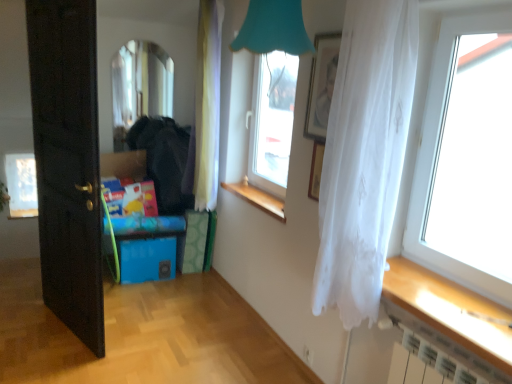
Where is `black wood door at left`? black wood door at left is located at coordinates (68, 162).

Describe the element at coordinates (164, 159) in the screenshot. The height and width of the screenshot is (384, 512). I see `matte black jacket at center` at that location.

Find the location of a particular element. This screenshot has height=384, width=512. transparent glass window at center, arranged as the second window when viewed from the front is located at coordinates (272, 121).

Identify the location of clear glass mirror at upper left, marked as the second window in a back-to-front arrangement. This screenshot has height=384, width=512. (140, 86).

What do you see at coordinates (140, 86) in the screenshot?
I see `clear glass mirror at upper left, which ranks as the 2th window in left-to-right order` at bounding box center [140, 86].

Locate an element on the screen. The height and width of the screenshot is (384, 512). black wood door at left is located at coordinates (68, 162).

Is white paper at left, the 1th window viewed from the left, turned away from blue plastic storage box at lower left?

white paper at left, the 1th window viewed from the left, does not have its back to blue plastic storage box at lower left.

Can you tell me how much white paper at left, arranged as the 4th window when viewed from the front, and blue plastic storage box at lower left differ in facing direction?

5.68 degrees.

From a real-world perspective, is white paper at left, the 1th window viewed from the left, physically located above or below blue plastic storage box at lower left?

Clearly, from a real-world perspective, white paper at left, the 1th window viewed from the left, is below blue plastic storage box at lower left.

Does white paper at left, the 1th window viewed from the left, come in front of blue plastic storage box at lower left?

No, the depth of white paper at left, the 1th window viewed from the left, is greater than that of blue plastic storage box at lower left.

Is matte black jacket at center situated inside transparent glass window at right, the 4th window positioned from the left, or outside?

matte black jacket at center cannot be found inside transparent glass window at right, the 4th window positioned from the left.

Considering the sizes of matte black jacket at center and transparent glass window at right, which appears as the fourth window when viewed from the back, in the image, is matte black jacket at center taller or shorter than transparent glass window at right, which appears as the fourth window when viewed from the back,?

matte black jacket at center is shorter than transparent glass window at right, which appears as the fourth window when viewed from the back.

Does matte black jacket at center appear on the right side of transparent glass window at right, acting as the 1th window starting from the front?

Incorrect, matte black jacket at center is not on the right side of transparent glass window at right, acting as the 1th window starting from the front.

Does transparent glass window at center, the third window viewed from the back, have a lesser height compared to transparent fabric curtain at right?

No, transparent glass window at center, the third window viewed from the back, is not shorter than transparent fabric curtain at right.

Choose the correct answer: Is transparent glass window at center, acting as the second window starting from the right, inside transparent fabric curtain at right or outside it?

transparent glass window at center, acting as the second window starting from the right, is outside transparent fabric curtain at right.

Does transparent glass window at center, the third window viewed from the back, come in front of transparent fabric curtain at right?

No, the depth of transparent glass window at center, the third window viewed from the back, is greater than that of transparent fabric curtain at right.

From the image's perspective, who appears lower, matte silver picture frame at upper center or black wood door at left?

black wood door at left is shown below in the image.

Considering the sizes of matte silver picture frame at upper center and black wood door at left in the image, is matte silver picture frame at upper center taller or shorter than black wood door at left?

Clearly, matte silver picture frame at upper center is shorter compared to black wood door at left.

Who is bigger, matte silver picture frame at upper center or black wood door at left?

black wood door at left.

Where is `the 2nd window counting from the right side of the white paper at left, the 1th window viewed from the left`? the 2nd window counting from the right side of the white paper at left, the 1th window viewed from the left is located at coordinates (272, 121).

From a real-world perspective, is transparent glass window at center, acting as the second window starting from the right, positioned above or below white paper at left, arranged as the 4th window when viewed from the front?

In terms of real-world spatial position, transparent glass window at center, acting as the second window starting from the right, is above white paper at left, arranged as the 4th window when viewed from the front.

Would you consider transparent glass window at center, acting as the second window starting from the right, to be distant from white paper at left, arranged as the 4th window when viewed from the front?

Indeed, transparent glass window at center, acting as the second window starting from the right, is not near white paper at left, arranged as the 4th window when viewed from the front.

Which is more to the right, transparent glass window at center, which ranks as the 3th window in left-to-right order, or white paper at left, the 1th window viewed from the left?

Result: From the viewer's perspective, transparent glass window at center, which ranks as the 3th window in left-to-right order, appears more on the right side.

Where is `curtain below the transparent glass window at center, which ranks as the 3th window in left-to-right order (from a real-world perspective)`? The width and height of the screenshot is (512, 384). curtain below the transparent glass window at center, which ranks as the 3th window in left-to-right order (from a real-world perspective) is located at coordinates (364, 155).

In the scene shown: From a real-world perspective, between white sheer curtain at right, marked as the 2th curtain in a left-to-right arrangement, and transparent glass window at center, acting as the second window starting from the right, who is vertically lower?

white sheer curtain at right, marked as the 2th curtain in a left-to-right arrangement.

Could transparent glass window at center, acting as the second window starting from the right, be considered to be inside white sheer curtain at right, marked as the 2th curtain in a left-to-right arrangement?

No.

Could you measure the distance between white sheer curtain at right, which appears as the first curtain when viewed from the front, and transparent glass window at center, acting as the second window starting from the right?

A distance of 4.51 feet exists between white sheer curtain at right, which appears as the first curtain when viewed from the front, and transparent glass window at center, acting as the second window starting from the right.

From a real-world perspective, which object rests below the other?

In real-world perspective, wooden at center is lower.

Is wooden at center inside white sheer curtain at center, which appears as the second curtain when viewed from the right?

No, white sheer curtain at center, which appears as the second curtain when viewed from the right, does not contain wooden at center.

Is wooden at center at the back of white sheer curtain at center, the 1th curtain viewed from the left?

That's not correct — white sheer curtain at center, the 1th curtain viewed from the left, is not looking away from wooden at center.

Between point (208, 118) and point (266, 202), which one is positioned in front?

The point (266, 202) is closer.

You are a GUI agent. You are given a task and a screenshot of the screen. Output one action in this format:
    pyautogui.click(x=<x>, y=<y>)
    Task: Click on the storage box above the white paper at left, which ranks as the first window in back-to-front order (from a real-world perspective)
    The height and width of the screenshot is (384, 512).
    Given the screenshot: What is the action you would take?
    pyautogui.click(x=147, y=260)

Which window is the 2nd one when counting from the right side of the matte black jacket at center? Please provide its 2D coordinates.

[(434, 158)]

Consider the image. Estimate the real-world distances between objects in this image. Which object is further from wooden at center, white sheer curtain at center, which appears as the second curtain when viewed from the right, or blue plastic storage box at lower left?

The object further to wooden at center is blue plastic storage box at lower left.

Which object lies nearer to the anchor point matte black jacket at center, wooden at center or white sheer curtain at right, which appears as the first curtain when viewed from the front?

Among the two, wooden at center is located nearer to matte black jacket at center.

Looking at the image, which one is located closer to wooden at center, white sheer curtain at center, which appears as the second curtain when viewed from the right, or transparent glass window at center, acting as the second window starting from the right?

The object closer to wooden at center is transparent glass window at center, acting as the second window starting from the right.

Which object lies nearer to the anchor point transparent glass window at center, which ranks as the 3th window in left-to-right order, clear glass mirror at upper left, which ranks as the 3th window in right-to-left order, or blue plastic storage box at lower left?

clear glass mirror at upper left, which ranks as the 3th window in right-to-left order, is closer to transparent glass window at center, which ranks as the 3th window in left-to-right order.

Based on their spatial positions, is transparent fabric curtain at right or white sheer curtain at center, which appears as the second curtain when viewed from the right, further from matte silver picture frame at upper center?

white sheer curtain at center, which appears as the second curtain when viewed from the right, is further to matte silver picture frame at upper center.

Estimate the real-world distances between objects in this image. Which object is closer to white sheer curtain at center, which is counted as the first curtain, starting from the back, blue plastic storage box at lower left or transparent fabric curtain at right?

blue plastic storage box at lower left is positioned closer to the anchor white sheer curtain at center, which is counted as the first curtain, starting from the back.

Considering their positions, is white sheer curtain at right, which appears as the first curtain when viewed from the front, positioned closer to transparent glass window at right, which ranks as the first window in right-to-left order, than transparent fabric curtain at right?

transparent fabric curtain at right is positioned closer to the anchor transparent glass window at right, which ranks as the first window in right-to-left order.

Estimate the real-world distances between objects in this image. Which object is closer to white paper at left, the 1th window viewed from the left, transparent fabric curtain at right or transparent glass window at center, the third window viewed from the back?

transparent glass window at center, the third window viewed from the back, lies closer to white paper at left, the 1th window viewed from the left, than the other object.

At what (x,y) coordinates should I click in order to perform the action: click on dark located between black wood door at left and transparent fabric curtain at right in the left-right direction. Please return your answer as a coordinate pair (x, y). This screenshot has height=384, width=512. Looking at the image, I should click on (164, 159).

Image resolution: width=512 pixels, height=384 pixels. In order to click on door located between transparent fabric curtain at right and white paper at left, which ranks as the 4th window in right-to-left order, in the depth direction in this screenshot , I will do `click(68, 162)`.

Locate an element on the screen. door located between transparent fabric curtain at right and clear glass mirror at upper left, which ranks as the 2th window in left-to-right order, in the depth direction is located at coordinates (68, 162).

What are the coordinates of `window sill between white paper at left, which ranks as the first window in back-to-front order, and transparent glass window at center, the third window viewed from the back, in the horizontal direction` in the screenshot? It's located at (257, 198).